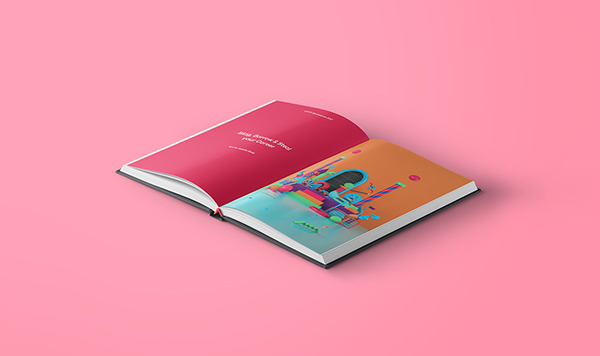
You are a GUI agent. You are given a task and a screenshot of the screen. Output one action in this format:
    pyautogui.click(x=<x>, y=<y>)
    Task: Click on the arch doorway
    
    Given the screenshot: What is the action you would take?
    pyautogui.click(x=349, y=178)